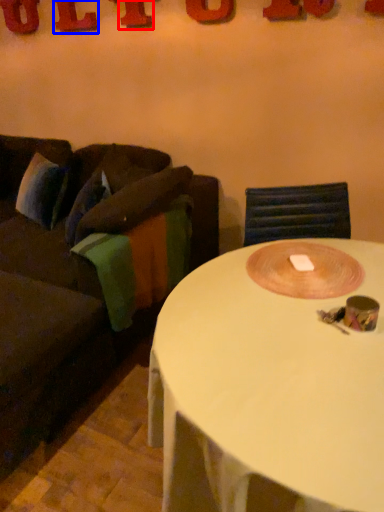
Question: Which object is closer to the camera taking this photo, letter (highlighted by a red box) or letter (highlighted by a blue box)?

Choices:
 (A) letter
 (B) letter

Answer: (A)